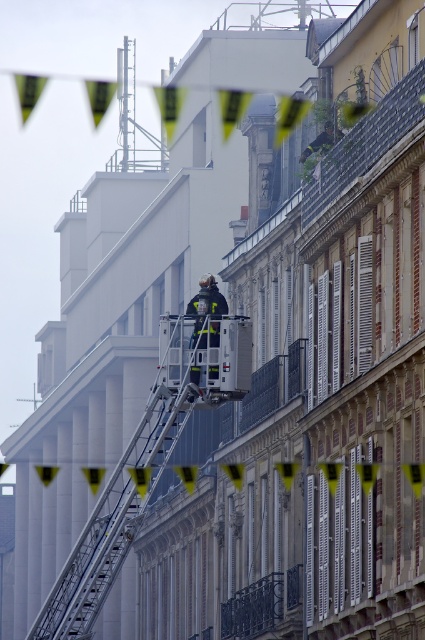
You are a drone operator trying to capture a photo of the metallic silver ladder at center. The drone is currently hovering at point (127, 488). Is the ladder directly below the drone?

Yes, the metallic silver ladder at center is located exactly at point (127, 488) where the drone is hovering, so the ladder is directly below the drone.

You are a photographer trying to capture a clear shot of the reflective silver fireman at center. However, the metallic silver ladder at center is blocking your view. Can you move to the left or right to avoid the ladder and still see the fireman?

The metallic silver ladder at center is closer to the viewer than the reflective silver fireman at center. Moving to the left or right might allow you to see around the ladder and still view the fireman, as the ladder is in front but not directly obscuring the entire area.

You are a photographer trying to capture the firefighter and ladder in the scene. If you want to ensure both the metallic silver ladder at center and the reflective silver fireman at center are fully visible in your photo, which object should you focus on to avoid cropping either?

The metallic silver ladder at center is wider than the reflective silver fireman at center, so you should focus on the metallic silver ladder at center to ensure both are fully visible without cropping.